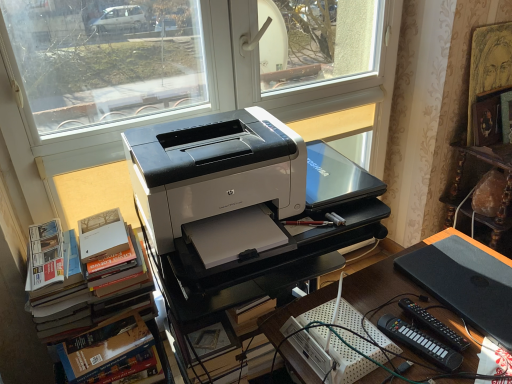
What are the coordinates of `free point to the left of black plastic remote control at lower right, which ranks as the 2th equipment in left-to-right order` in the screenshot? It's located at (368, 321).